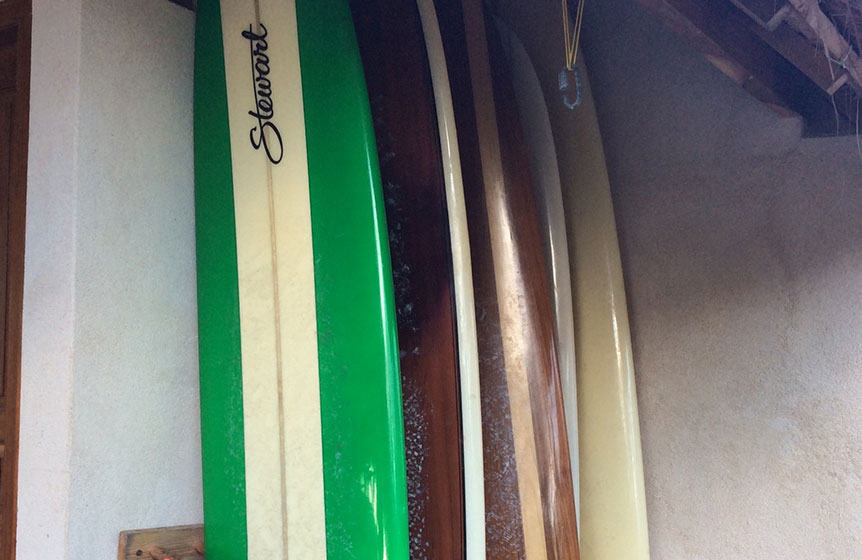
At what (x,y) coordinates should I click in order to perform the action: click on peg. Please return your answer as a coordinate pair (x, y). Looking at the image, I should click on (159, 540), (204, 533).